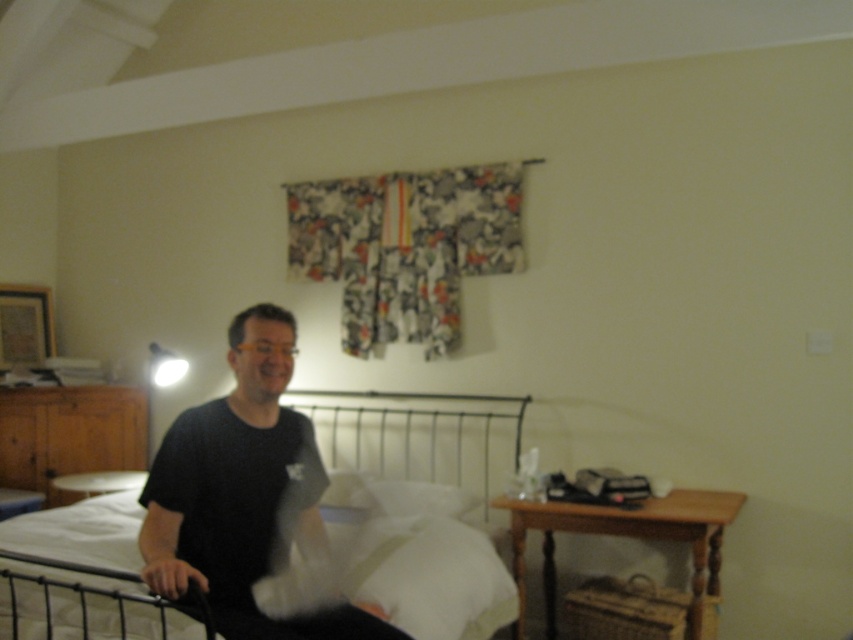
Does white fabric bed at center appear on the right side of white soft pillow at center?

No, white fabric bed at center is not to the right of white soft pillow at center.

Consider the image. Is white fabric bed at center above white soft pillow at center?

No.

Does point (488, 586) come farther from viewer compared to point (372, 488)?

No, it is not.

Image resolution: width=853 pixels, height=640 pixels. Find the location of `white fabric bed at center`. white fabric bed at center is located at coordinates (428, 576).

Locate an element on the screen. This screenshot has width=853, height=640. black matte shirt at center is located at coordinates (242, 493).

Does point (310, 538) come farther from viewer compared to point (384, 502)?

That is False.

Image resolution: width=853 pixels, height=640 pixels. Describe the element at coordinates (242, 493) in the screenshot. I see `black matte shirt at center` at that location.

Locate an element on the screen. This screenshot has height=640, width=853. black matte shirt at center is located at coordinates (242, 493).

Who is shorter, black matte shirt at center or white fabric bed at center?

white fabric bed at center is shorter.

Is black matte shirt at center to the left of white fabric bed at center from the viewer's perspective?

Incorrect, black matte shirt at center is not on the left side of white fabric bed at center.

Which is behind, point (163, 573) or point (439, 628)?

Positioned behind is point (439, 628).

This screenshot has width=853, height=640. I want to click on black matte shirt at center, so click(x=242, y=493).